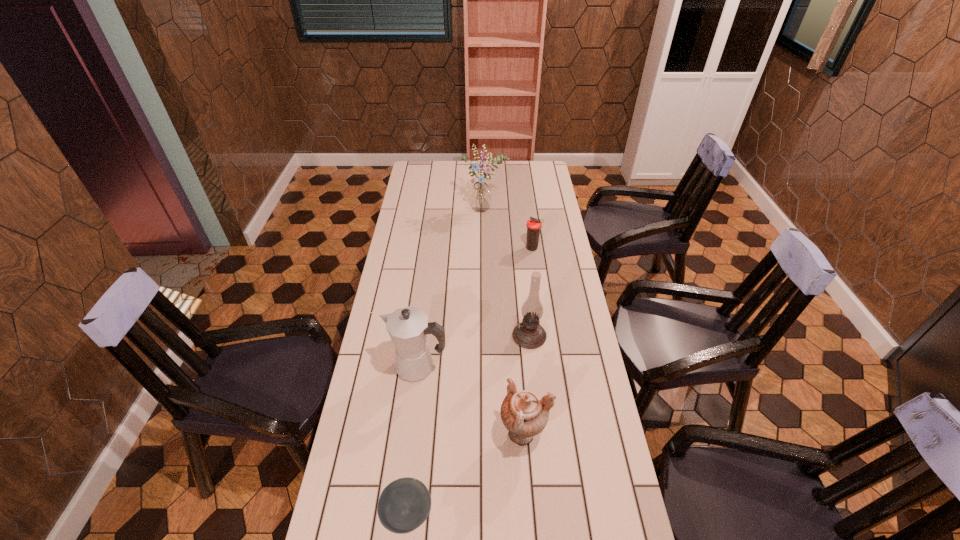
Locate an element on the screen. The width and height of the screenshot is (960, 540). free space located 0.250m on the left of the urn is located at coordinates (414, 435).

This screenshot has width=960, height=540. I want to click on free point located on the front of the thermos bottle, so click(537, 283).

I want to click on object that is at the left edge, so click(x=408, y=327).

Locate an element on the screen. The width and height of the screenshot is (960, 540). oil lamp that is at the right edge is located at coordinates (529, 333).

Find the location of `thermos bottle that is at the right edge`. thermos bottle that is at the right edge is located at coordinates click(x=534, y=225).

Identify the location of vacant space at the far edge. (444, 172).

The height and width of the screenshot is (540, 960). In the image, there is a desktop. In order to click on free space at the left edge in this screenshot , I will do `click(392, 455)`.

Find the location of a particular element. The width and height of the screenshot is (960, 540). vacant point at the right edge is located at coordinates (539, 217).

Locate an element on the screen. The height and width of the screenshot is (540, 960). unoccupied area between the thermos bottle and the farthest object is located at coordinates coord(509,230).

Find the location of a particular element. The height and width of the screenshot is (540, 960). free space that is in between the oil lamp and the coffeepot is located at coordinates (473, 352).